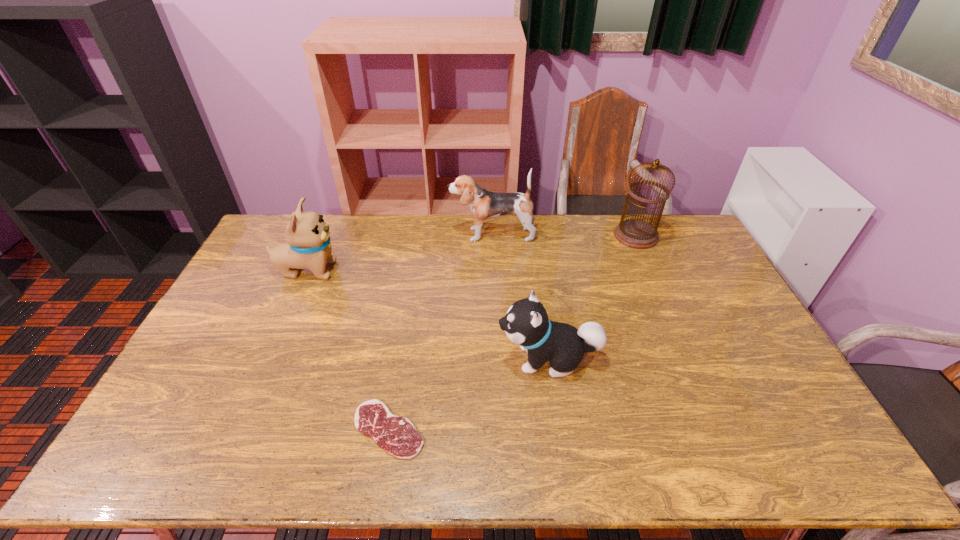
This screenshot has height=540, width=960. Identify the location of object present at the left edge. (308, 245).

In order to click on object at the right edge in this screenshot , I will do `click(638, 234)`.

Locate an element on the screen. Image resolution: width=960 pixels, height=540 pixels. object positioned at the far right corner is located at coordinates (638, 234).

This screenshot has height=540, width=960. In the image, there is a desktop. Identify the location of vacant region at the far edge. (399, 246).

Locate an element on the screen. The height and width of the screenshot is (540, 960). vacant space at the near edge of the desktop is located at coordinates (651, 455).

The height and width of the screenshot is (540, 960). In the image, there is a desktop. Identify the location of blank space at the left edge. (236, 296).

This screenshot has height=540, width=960. What are the coordinates of `vacant area at the right edge of the desktop` in the screenshot? It's located at (708, 265).

Locate an element on the screen. The height and width of the screenshot is (540, 960). free location at the far left corner of the desktop is located at coordinates pos(283,223).

Find the location of `vacant area that lies between the farthest puppy and the nearest puppy`. vacant area that lies between the farthest puppy and the nearest puppy is located at coordinates (520, 296).

Locate an element on the screen. The image size is (960, 540). free space between the leftmost puppy and the fourth tallest object is located at coordinates (428, 314).